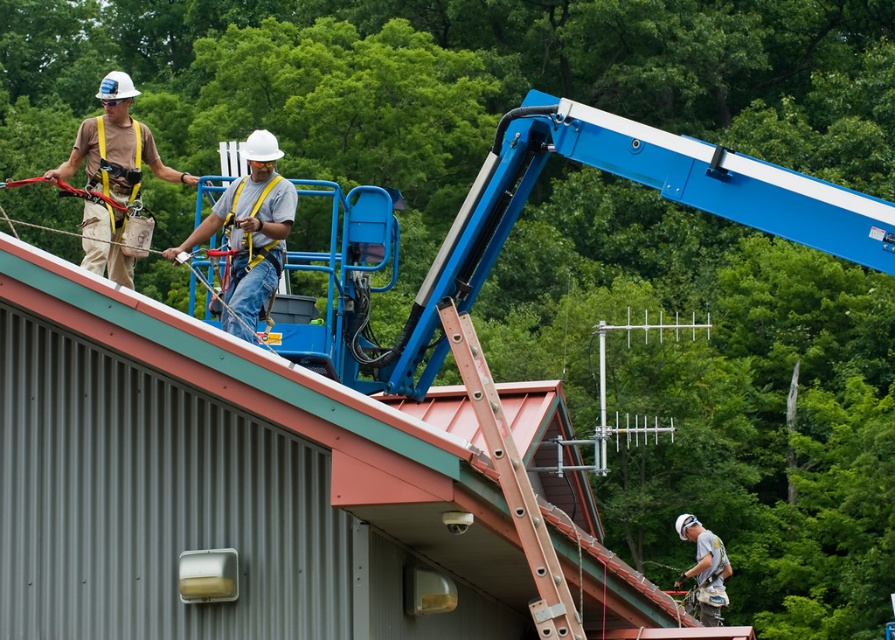
Is metallic orange ladder at center further to the viewer compared to white matte helmet at lower right?

No, it is in front of white matte helmet at lower right.

Between metallic orange ladder at center and white matte helmet at lower right, which one appears on the right side from the viewer's perspective?

From the viewer's perspective, white matte helmet at lower right appears more on the right side.

Which is behind, point (505, 422) or point (714, 568)?

Point (714, 568)

This screenshot has height=640, width=895. Find the location of `metallic orange ladder at center`. metallic orange ladder at center is located at coordinates (512, 481).

Is white hard hat at center further to the viewer compared to white matte helmet at lower right?

No.

Can you confirm if white hard hat at center is smaller than white matte helmet at lower right?

No, white hard hat at center is not smaller than white matte helmet at lower right.

Which is behind, point (276, 237) or point (713, 545)?

The point (713, 545) is behind.

The image size is (895, 640). What are the coordinates of `white hard hat at center` in the screenshot? It's located at (249, 234).

Is point (245, 241) farther from camera compared to point (81, 129)?

That is False.

Does white hard hat at center come in front of matte khaki pants at upper left?

Yes.

In the scene shown: Who is more forward, (260, 244) or (101, 99)?

Point (260, 244) is in front.

Locate an element on the screen. This screenshot has width=895, height=640. white hard hat at center is located at coordinates (249, 234).